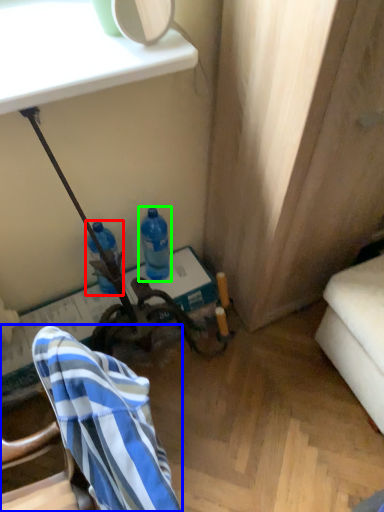
Question: Which object is positioned closest to bottle (highlighted by a red box)? Select from chair (highlighted by a blue box) and bottle (highlighted by a green box).

Choices:
 (A) chair
 (B) bottle

Answer: (B)